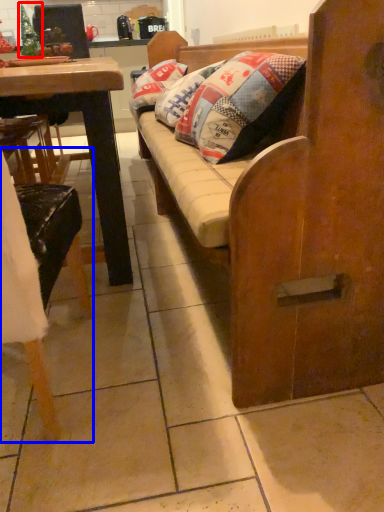
Question: Which point is closer to the camera, christmas tree (highlighted by a red box) or chair (highlighted by a blue box)?

Choices:
 (A) christmas tree
 (B) chair

Answer: (B)